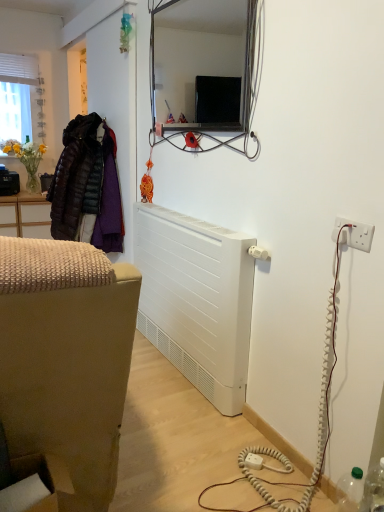
Question: From the image's perspective, is white matte radiator at lower center below white plastic plug at lower center?

Choices:
 (A) yes
 (B) no

Answer: (B)

Question: Is white matte radiator at lower center located outside white plastic plug at lower center?

Choices:
 (A) yes
 (B) no

Answer: (A)

Question: Considering the relative sizes of white matte radiator at lower center and white plastic plug at lower center in the image provided, is white matte radiator at lower center smaller than white plastic plug at lower center?

Choices:
 (A) no
 (B) yes

Answer: (A)

Question: Is white matte radiator at lower center far away from white plastic plug at lower center?

Choices:
 (A) no
 (B) yes

Answer: (A)

Question: Is white matte radiator at lower center oriented away from white plastic plug at lower center?

Choices:
 (A) no
 (B) yes

Answer: (A)

Question: Is white matte radiator at lower center taller than white plastic plug at lower center?

Choices:
 (A) no
 (B) yes

Answer: (B)

Question: Could metallic frame mirror at upper center be considered to be inside white plastic plug at lower center?

Choices:
 (A) no
 (B) yes

Answer: (A)

Question: Is white plastic plug at lower center to the left of metallic frame mirror at upper center from the viewer's perspective?

Choices:
 (A) no
 (B) yes

Answer: (A)

Question: From the image's perspective, is white plastic plug at lower center on metallic frame mirror at upper center?

Choices:
 (A) yes
 (B) no

Answer: (B)

Question: Is white plastic plug at lower center aimed at metallic frame mirror at upper center?

Choices:
 (A) no
 (B) yes

Answer: (A)

Question: Does white plastic plug at lower center lie in front of metallic frame mirror at upper center?

Choices:
 (A) yes
 (B) no

Answer: (B)

Question: From a real-world perspective, is white plastic plug at lower center located beneath metallic frame mirror at upper center?

Choices:
 (A) no
 (B) yes

Answer: (B)

Question: From a real-world perspective, is transparent plastic bottle at lower right positioned under white plastic electrical outlet at right based on gravity?

Choices:
 (A) no
 (B) yes

Answer: (B)